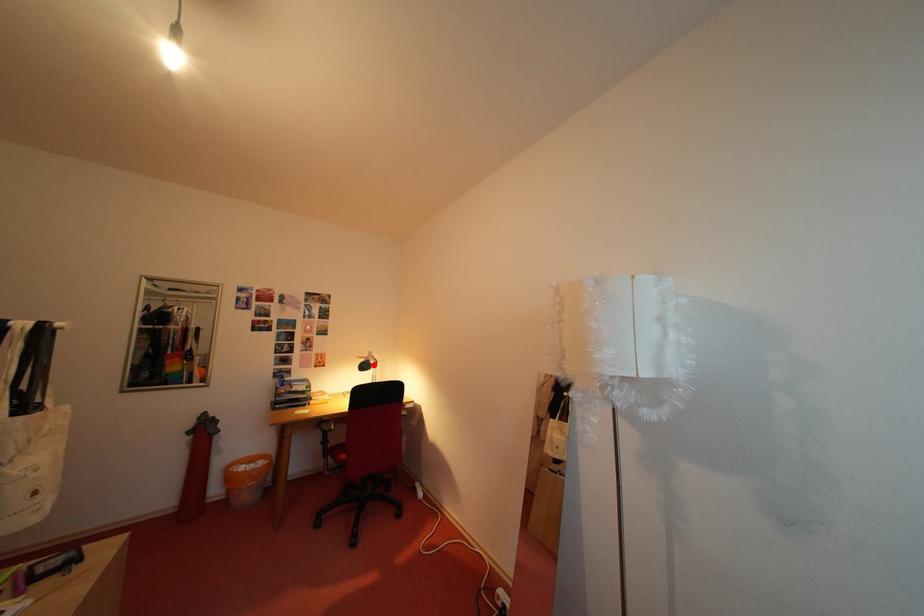
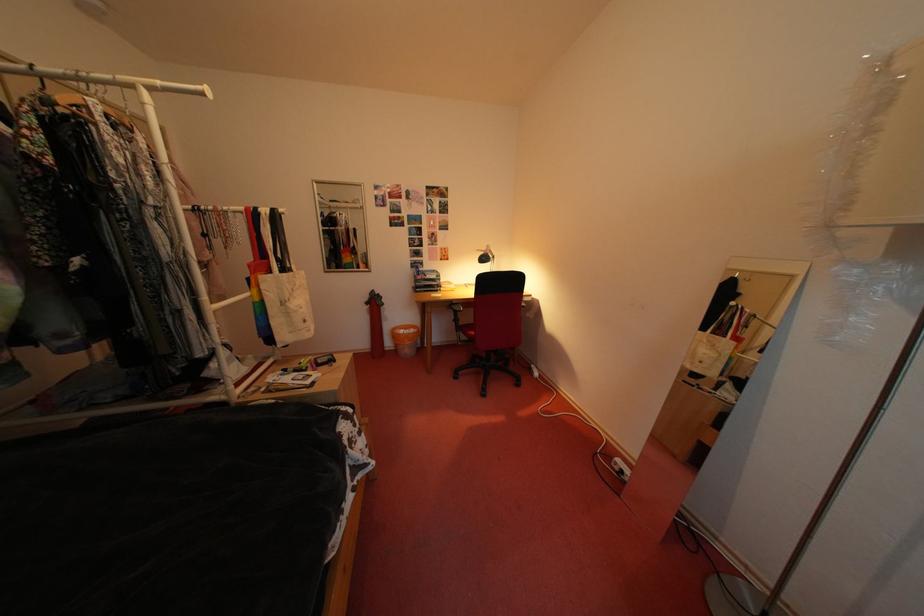
Where in the second image is the point corresponding to the highlighted location from the first image?

(492, 257)